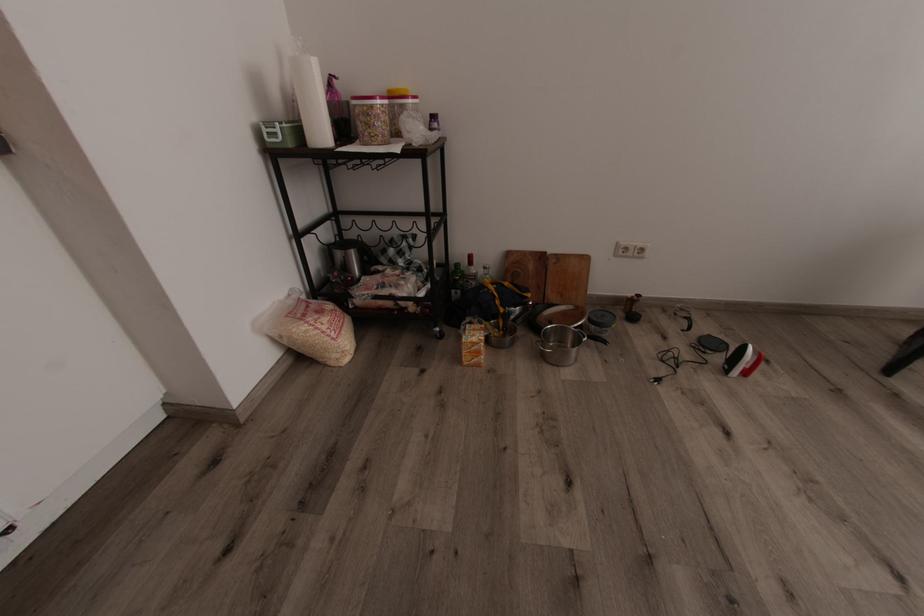
The width and height of the screenshot is (924, 616). I want to click on metal pot handle, so click(550, 350).